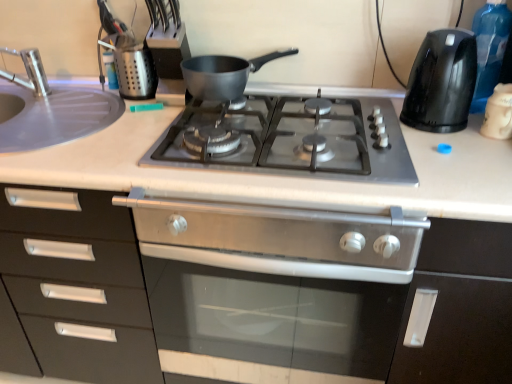
The width and height of the screenshot is (512, 384). Identify the location of free location in front of white glossy coffee cup at upper right, which is counted as the 1th kitchen appliance, starting from the right. (486, 167).